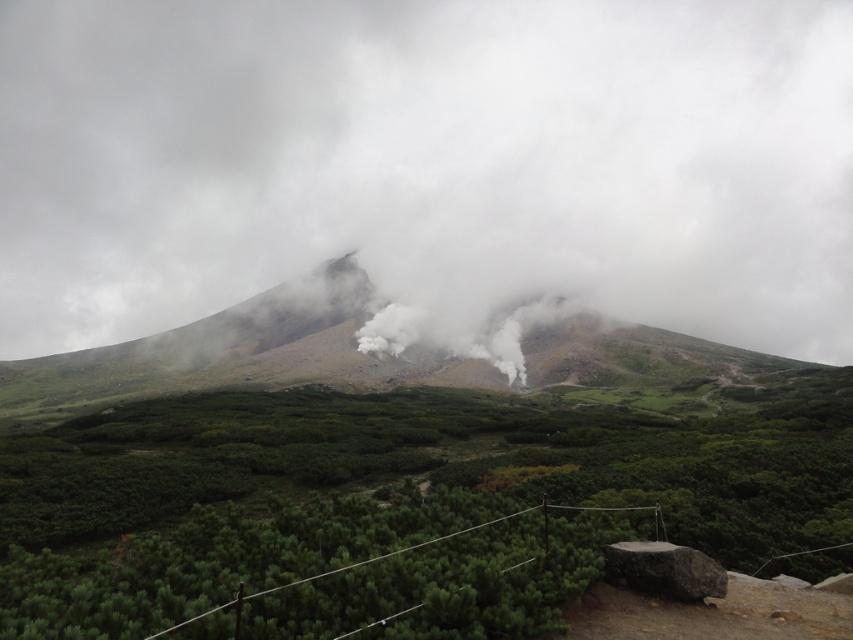
You are a hiker who wants to take a photo of the white smoke at center and the green leafy shrubs at center. Which object should you focus on first if you want to capture both in a single frame without moving the camera?

You should focus on the white smoke at center first because it is wider than the green leafy shrubs at center, so it requires a wider angle to capture both in one frame.

You are a hiker trying to locate the source of the white smoke at center in the misty mountain landscape. According to the coordinates provided, where exactly is the white smoke positioned relative to the image frame?

The white smoke at center is located at coordinates point (428, 163), which places it approximately one quarter of the way from the left edge and halfway down from the top of the image frame.

Based on the photo, you are a hiker planning to cross the mountain. You see the white smoke at center and the green leafy shrubs at center. How far apart are these two landmarks?

The distance between the white smoke at center and the green leafy shrubs at center is 447.59 meters.